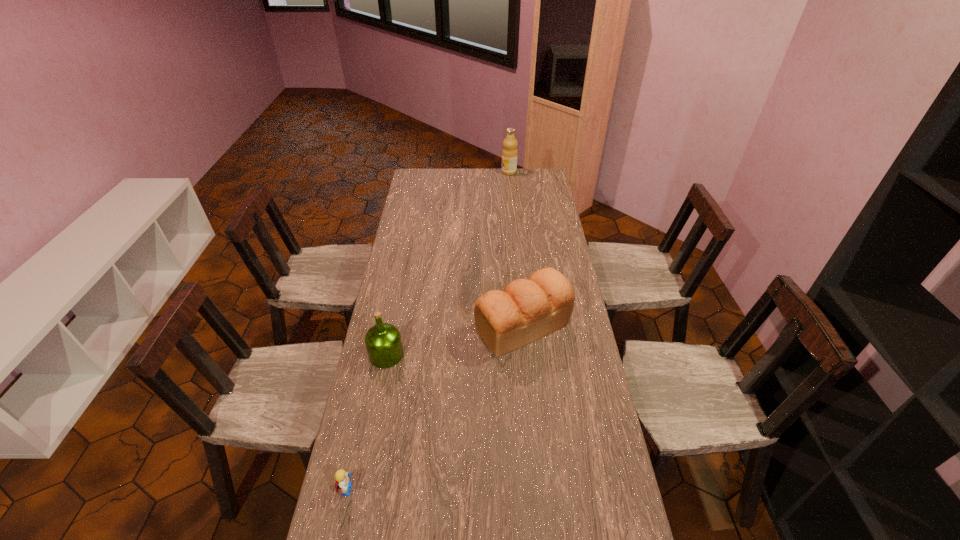
Identify which object is the second closest to the right olive oil. Please provide its 2D coordinates. Your answer should be formatted as a tuple, i.e. [(x, y)], where the tuple contains the x and y coordinates of a point satisfying the conditions above.

[(383, 342)]

This screenshot has height=540, width=960. In order to click on object that stands as the closest to the farthest object in this screenshot , I will do `click(527, 310)`.

Image resolution: width=960 pixels, height=540 pixels. I want to click on vacant area that satisfies the following two spatial constraints: 1. on the label of the right olive oil; 2. on the front side of the nearer olive oil, so click(527, 355).

Find the location of a particular element. Image resolution: width=960 pixels, height=540 pixels. free region that satisfies the following two spatial constraints: 1. on the label of the right olive oil; 2. on the front side of the shorter olive oil is located at coordinates (527, 355).

What are the coordinates of `free space that satisfies the following two spatial constraints: 1. on the label of the taller olive oil; 2. on the front side of the bread` in the screenshot? It's located at (524, 327).

This screenshot has width=960, height=540. I want to click on free space that satisfies the following two spatial constraints: 1. on the label of the tallest object; 2. on the front side of the nearer olive oil, so click(527, 355).